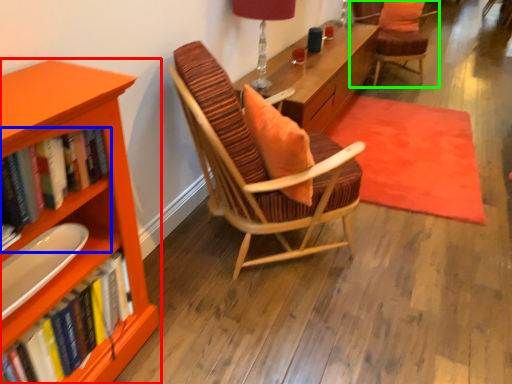
Question: Which object is positioned closest to bookcase (highlighted by a red box)? Select from book (highlighted by a blue box) and chair (highlighted by a green box).

Choices:
 (A) book
 (B) chair

Answer: (A)